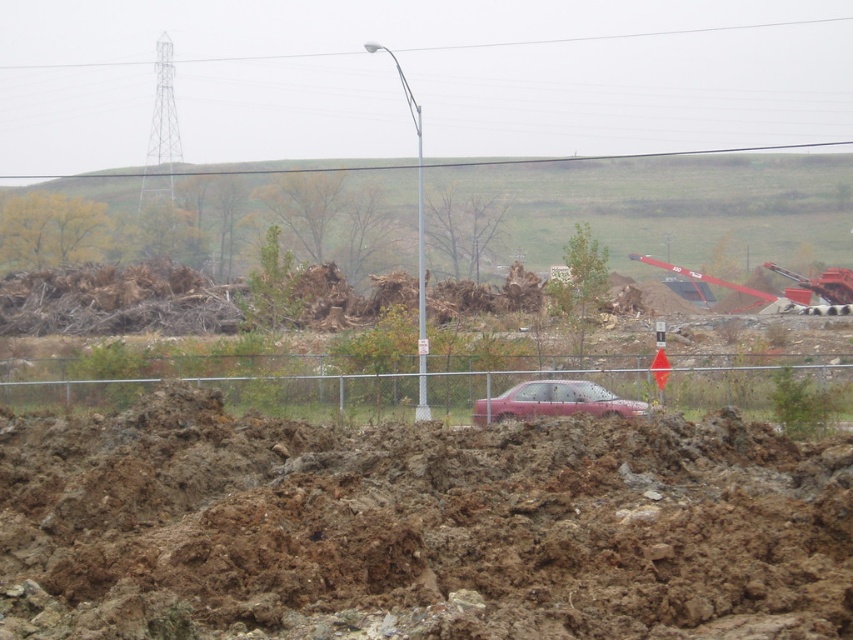
Which is below, brown muddy dirt at center or metallic chain-link fence at center?

brown muddy dirt at center is below.

Which is behind, point (253, 634) or point (233, 396)?

Point (233, 396)

Is point (57, 451) positioned in front of point (836, 378)?

Yes, point (57, 451) is in front of point (836, 378).

Identify the location of brown muddy dirt at center. The width and height of the screenshot is (853, 640). (418, 528).

Does brown muddy dirt at center appear on the right side of pink matte car at center?

Incorrect, brown muddy dirt at center is not on the right side of pink matte car at center.

Measure the distance between brown muddy dirt at center and pink matte car at center.

They are 16.07 meters apart.

Is point (694, 493) farther from viewer compared to point (520, 384)?

No, (694, 493) is closer to viewer.

Image resolution: width=853 pixels, height=640 pixels. What are the coordinates of `brown muddy dirt at center` in the screenshot? It's located at (418, 528).

Is metallic chain-link fence at center thinner than pink matte car at center?

Incorrect, metallic chain-link fence at center's width is not less than pink matte car at center's.

Which is behind, point (306, 410) or point (581, 403)?

Point (306, 410)

Find the location of `metallic chain-link fence at center`. metallic chain-link fence at center is located at coordinates (231, 392).